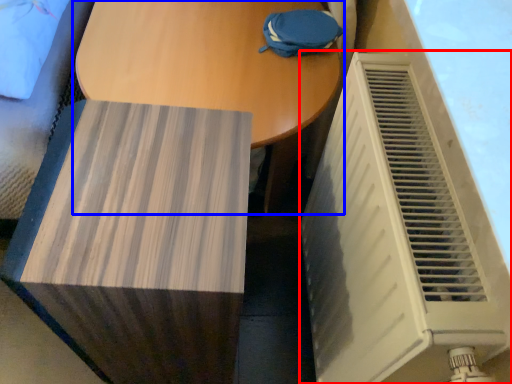
Question: Which object is further to the camera taking this photo, air conditioning (highlighted by a red box) or table (highlighted by a blue box)?

Choices:
 (A) air conditioning
 (B) table

Answer: (B)